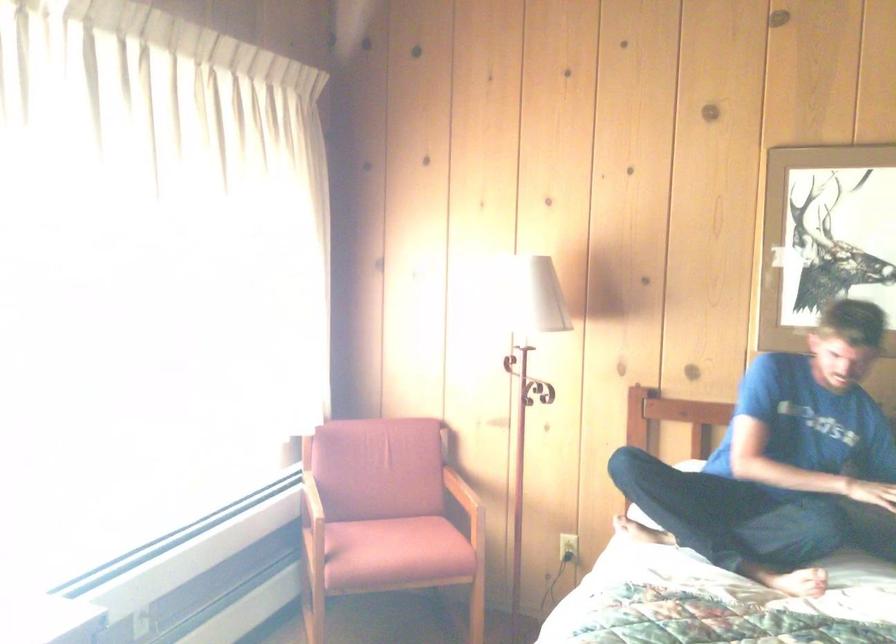
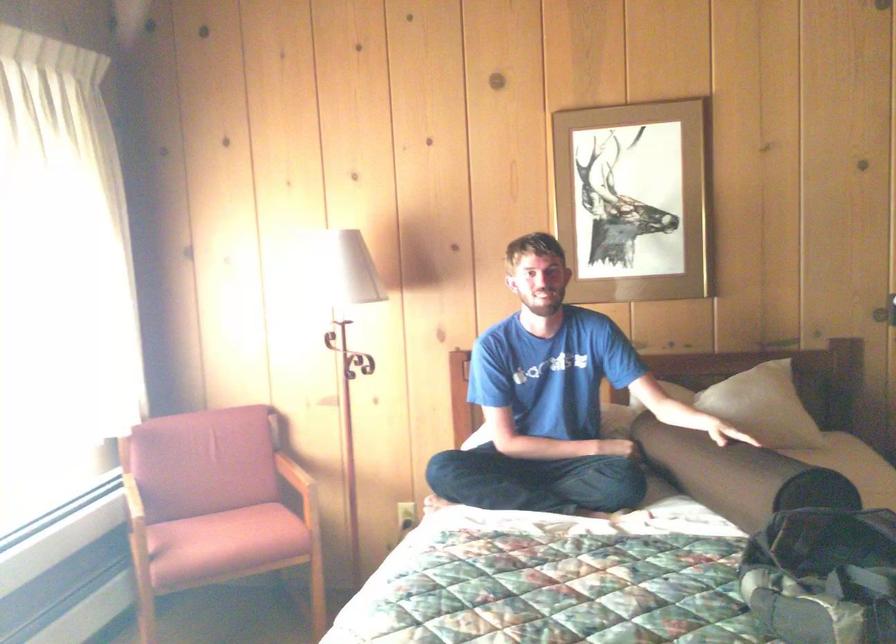
Where in the second image is the point corresponding to [391,553] from the first image?

(224, 543)